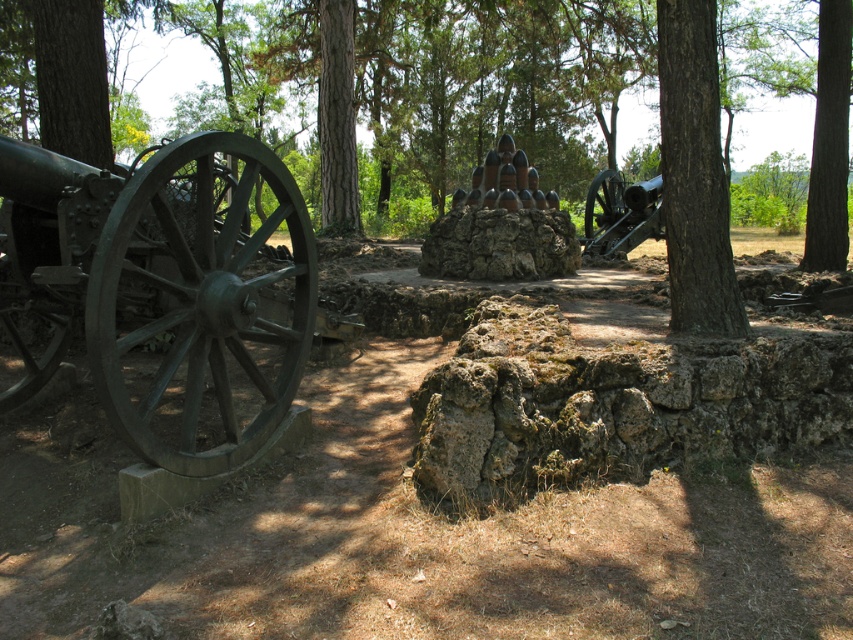
Question: Which point is farther from the camera taking this photo?

Choices:
 (A) (833, 10)
 (B) (28, 275)

Answer: (A)

Question: Considering the real-world distances, which object is farthest from the brown rough bark tree at right?

Choices:
 (A) green metal cannon at left
 (B) green rough bark tree at center
 (C) green metal cannon at right

Answer: (C)

Question: Among these objects, which one is farthest from the camera?

Choices:
 (A) brown rough bark tree at right
 (B) green metal cannon at right
 (C) green rough bark tree at center

Answer: (B)

Question: Is green rough bark tree at center to the left of green metal cannon at right from the viewer's perspective?

Choices:
 (A) no
 (B) yes

Answer: (A)

Question: Does green metal cannon at left have a larger size compared to brown rough bark tree at right?

Choices:
 (A) no
 (B) yes

Answer: (B)

Question: Can you confirm if brown rough bark tree at right is wider than green rough bark tree at center?

Choices:
 (A) yes
 (B) no

Answer: (B)